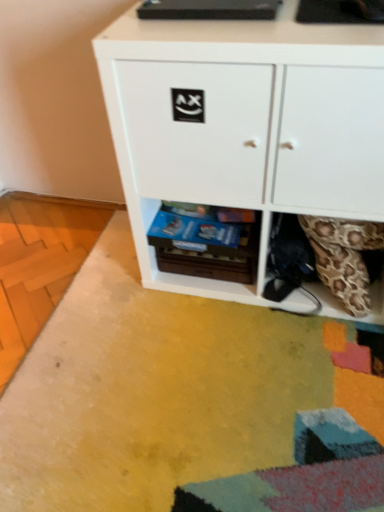
Where is `vacant area that lies in front of wooden drawer at lower center`? vacant area that lies in front of wooden drawer at lower center is located at coordinates (212, 333).